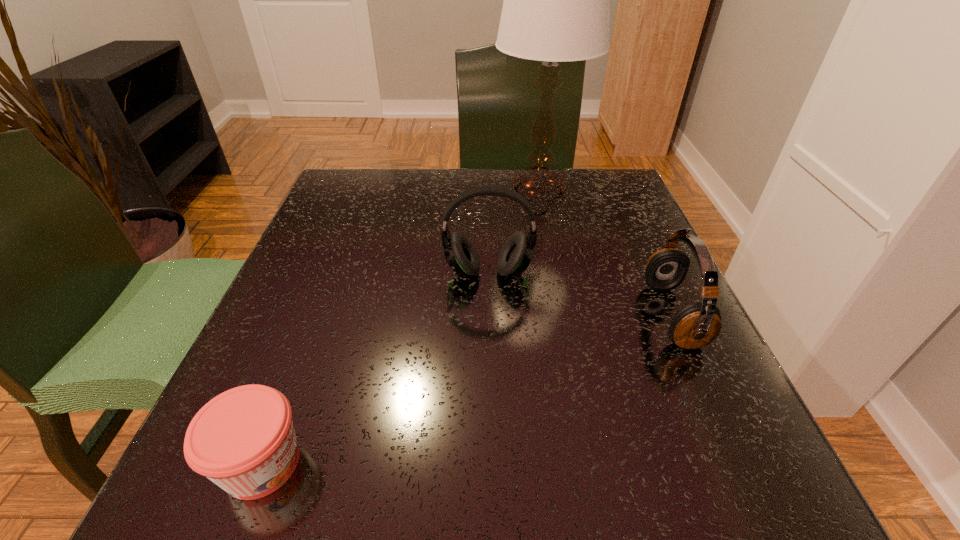
The image size is (960, 540). What are the coordinates of `free space at the near right corner of the desktop` in the screenshot? It's located at (654, 502).

The width and height of the screenshot is (960, 540). Identify the location of empty location between the nearest object and the shorter headset. (468, 389).

The image size is (960, 540). In order to click on empty space between the left headset and the nearest object in this screenshot , I will do `click(375, 368)`.

Identify the location of vacant area that lies between the right headset and the left headset. (581, 294).

The image size is (960, 540). What are the coordinates of `vacant area that lies between the taller headset and the table lamp` in the screenshot? It's located at click(514, 232).

In order to click on free space between the table lamp and the taller headset in this screenshot , I will do `click(514, 232)`.

Locate an element on the screen. This screenshot has width=960, height=540. empty location between the farthest object and the taller headset is located at coordinates (514, 232).

Image resolution: width=960 pixels, height=540 pixels. In order to click on free spot between the third tallest object and the farthest object in this screenshot , I will do `click(605, 253)`.

Find the location of `vacant space that is in between the shorter headset and the table lamp`. vacant space that is in between the shorter headset and the table lamp is located at coordinates (605, 253).

Find the location of a particular element. The image size is (960, 540). vacant point located between the jam and the table lamp is located at coordinates (400, 327).